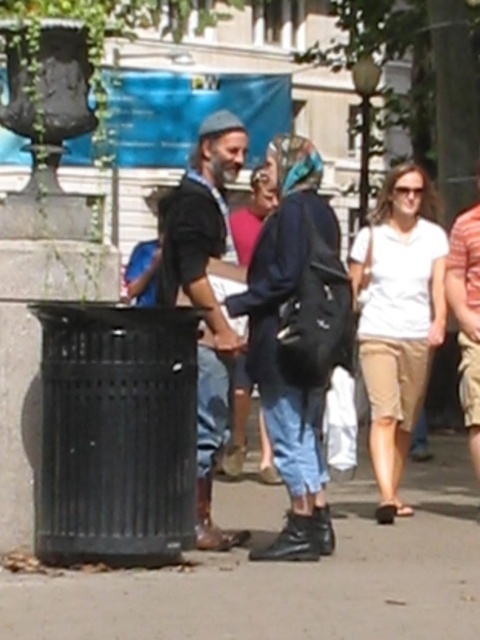
Is white cotton shirt at center below dark brown leather boots at center?

Correct, white cotton shirt at center is located below dark brown leather boots at center.

Is white cotton shirt at center behind dark brown leather boots at center?

Yes, it is.

Where is `white cotton shirt at center`? The width and height of the screenshot is (480, 640). white cotton shirt at center is located at coordinates (397, 321).

In the scene shown: Between denim jacket at center and white cotton shirt at center, which one appears on the right side from the viewer's perspective?

white cotton shirt at center is more to the right.

Does denim jacket at center have a lesser height compared to white cotton shirt at center?

In fact, denim jacket at center may be taller than white cotton shirt at center.

Where is `denim jacket at center`? This screenshot has height=640, width=480. denim jacket at center is located at coordinates pos(277,342).

Who is more distant from viewer, (x=48, y=586) or (x=424, y=316)?

The point (x=424, y=316) is behind.

Does black rubber boots at lower center have a greater height compared to white cotton shirt at center?

No.

Which is behind, point (242, 579) or point (428, 294)?

Positioned behind is point (428, 294).

Find the location of a particular element. black rubber boots at lower center is located at coordinates (290, 577).